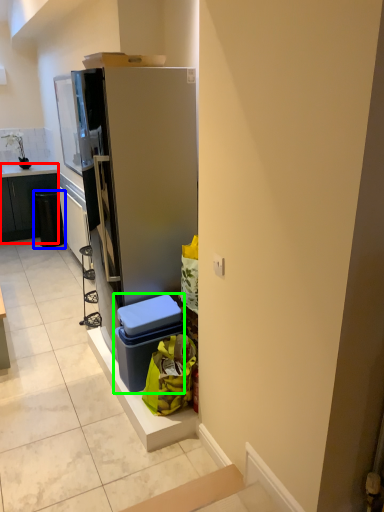
Question: Considering the real-world distances, which object is farthest from cabinetry (highlighted by a red box)? recycling bin (highlighted by a blue box) or storage box (highlighted by a green box)?

Choices:
 (A) recycling bin
 (B) storage box

Answer: (B)